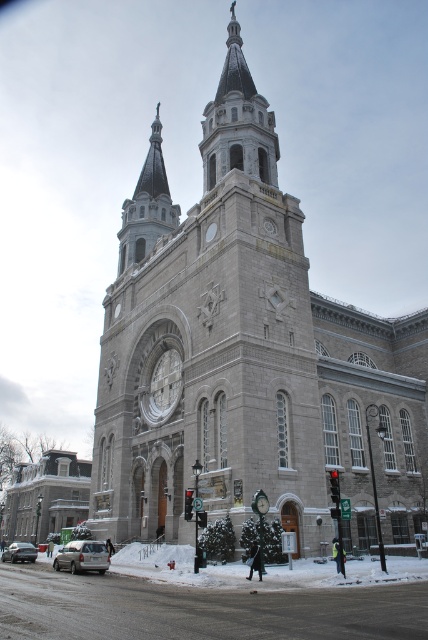
Question: Estimate the real-world distances between objects in this image. Which object is farther from the gray stone church at center?

Choices:
 (A) gray stone church at lower left
 (B) gray stone bell tower at upper center
 (C) silver metallic suv at lower left

Answer: (A)

Question: Can you confirm if gray stone church at lower left is positioned below silver metallic suv at lower left?

Choices:
 (A) yes
 (B) no

Answer: (A)

Question: Does gray stone church at center have a larger size compared to gray stone church at lower left?

Choices:
 (A) no
 (B) yes

Answer: (B)

Question: Among these objects, which one is nearest to the camera?

Choices:
 (A) gray stone church at center
 (B) gray stone church at lower left

Answer: (A)

Question: Which point is closer to the camera?

Choices:
 (A) (86, 461)
 (B) (229, 118)
 (C) (95, 544)

Answer: (C)

Question: Is the position of gray stone church at lower left less distant than that of silver metallic sedan at lower left?

Choices:
 (A) no
 (B) yes

Answer: (A)